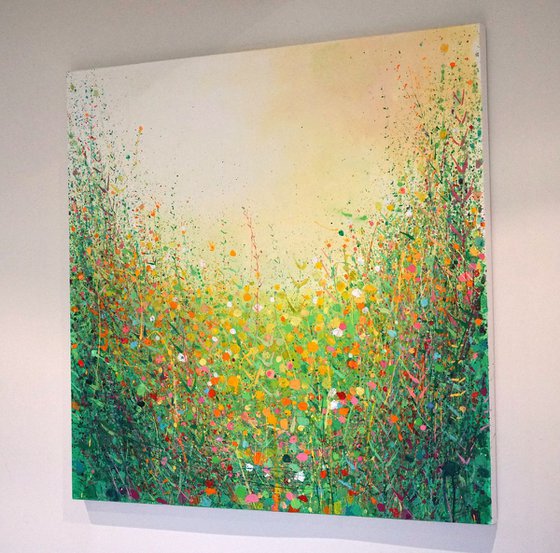
Find the location of a particular element. Image resolution: width=560 pixels, height=553 pixels. sky in painting is located at coordinates (277, 140).